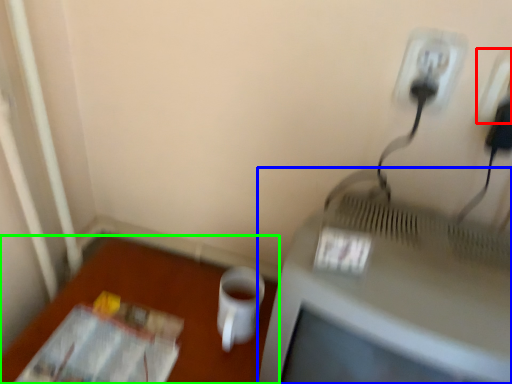
Question: Which object is positioned farthest from electric outlet (highlighted by a red box)? Select from television (highlighted by a blue box) and table (highlighted by a green box).

Choices:
 (A) television
 (B) table

Answer: (B)